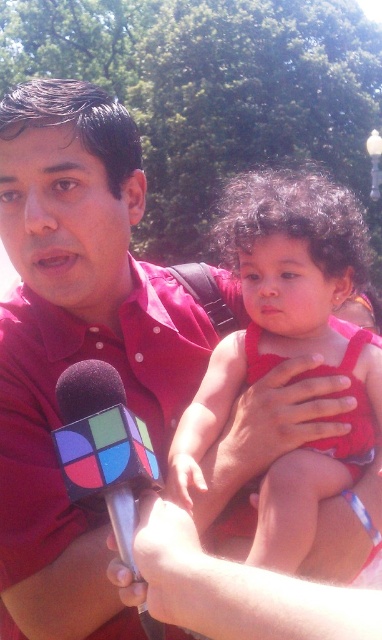
Question: Which of the following is the closest to the observer?

Choices:
 (A) matte red dress at center
 (B) rubberized plastic microphone at lower left

Answer: (B)

Question: Can you confirm if matte red dress at center is positioned to the right of rubberized plastic microphone at lower left?

Choices:
 (A) yes
 (B) no

Answer: (A)

Question: Which point appears farthest from the camera in this image?

Choices:
 (A) (119, 516)
 (B) (365, 253)

Answer: (B)

Question: Which object appears farthest from the camera in this image?

Choices:
 (A) matte red dress at center
 (B) rubberized plastic microphone at lower left

Answer: (A)

Question: Is matte red dress at center below rubberized plastic microphone at lower left?

Choices:
 (A) no
 (B) yes

Answer: (A)

Question: Is matte red dress at center closer to camera compared to rubberized plastic microphone at lower left?

Choices:
 (A) yes
 (B) no

Answer: (B)